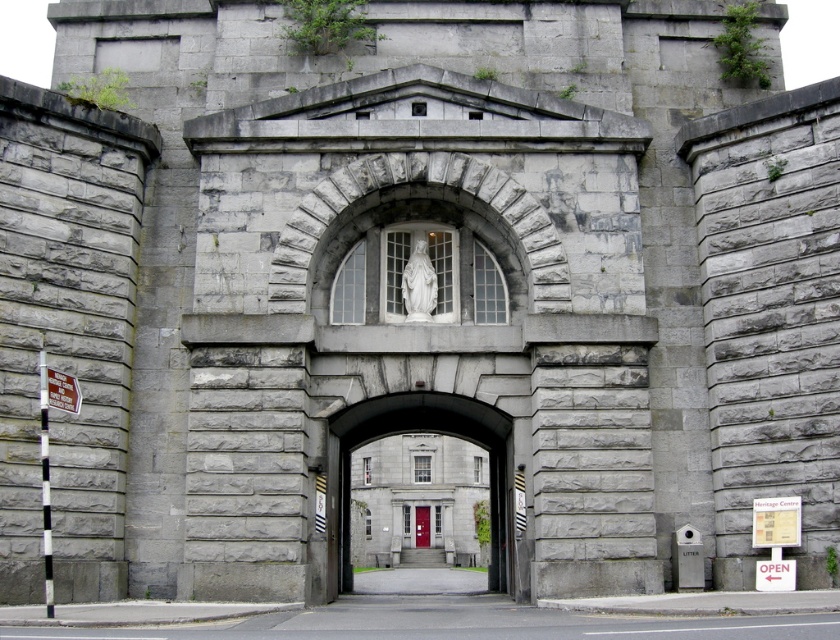
Question: Which of the following is the farthest from the observer?

Choices:
 (A) (43, 532)
 (B) (69, 396)
 (C) (491, 452)

Answer: (C)

Question: Is smooth stone archway at center positioned at the back of white plastic sign at left?

Choices:
 (A) no
 (B) yes

Answer: (B)

Question: Does white plastic sign at left come behind red matte door at center?

Choices:
 (A) no
 (B) yes

Answer: (A)

Question: Which of the following is the closest to the observer?

Choices:
 (A) white plastic sign at left
 (B) black and white striped pole at left
 (C) red matte door at center

Answer: (B)

Question: Is smooth stone archway at center behind white plastic sign at left?

Choices:
 (A) yes
 (B) no

Answer: (A)

Question: Among these objects, which one is nearest to the camera?

Choices:
 (A) black and white striped pole at left
 (B) white plastic sign at left
 (C) smooth stone archway at center
 (D) red matte door at center

Answer: (A)